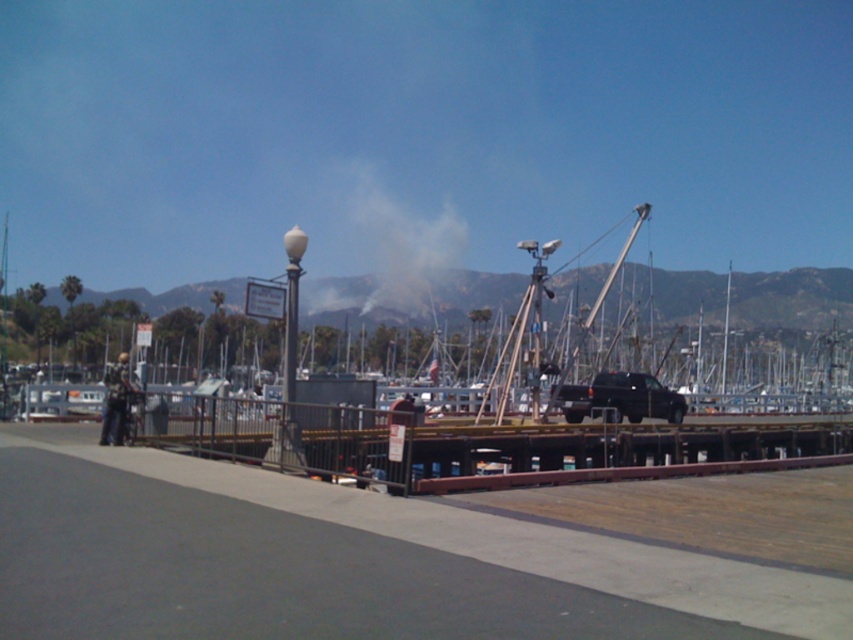
Looking at this image, you are standing at point (288, 355) and want to walk to point (346, 179). Is there a clear path between these two points without any obstacles?

Point (346, 179) is behind point (288, 355), so there is a clear path between them as long as there are no physical barriers blocking the way. Since the scene description mentions a paved walkway and a marina with boats, but does not specify obstacles between these points, it is assumed the path is clear.

You are a photographer standing on the wooden dock at lower center, trying to capture a clear photo of the large crane in the midground. However, the white glossy lamp post at center is blocking your view. Can you move to a position where you can see the crane without the lamp post obstructing your view?

The white glossy lamp post at center is behind the wooden dock at lower center, so if you move to a position where you are not behind the wooden dock at lower center, you can see the crane without obstruction.

You are a photographer trying to capture a clear shot of the wooden dock at lower center and the white smoke at upper center. Based on their positions, which object is located to the left of the other?

The wooden dock at lower center is positioned on the left side of white smoke at upper center.